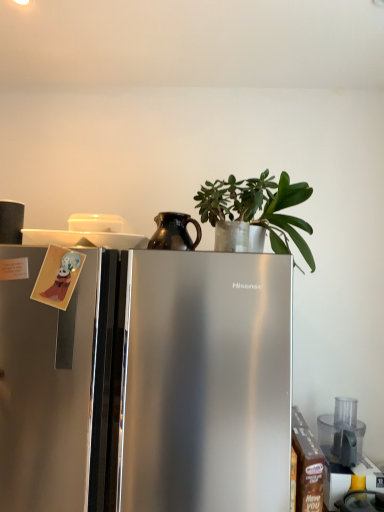
Question: From the image's perspective, is matte black coffee cup at upper left, which appears as the third appliance when viewed from the right, above or below green matte plant at upper center?

Choices:
 (A) below
 (B) above

Answer: (A)

Question: In terms of height, does matte black coffee cup at upper left, the 3th appliance from the bottom, look taller or shorter compared to green matte plant at upper center?

Choices:
 (A) tall
 (B) short

Answer: (B)

Question: Which object is the farthest from the matte black coffee cup at upper left, which is the 2th appliance in back-to-front order?

Choices:
 (A) green matte plant at upper center
 (B) shiny brown pitcher at center, which ranks as the 2th appliance in left-to-right order
 (C) transparent plastic food processor at lower right, the third appliance when ordered from left to right
 (D) satin silver refrigerator at center

Answer: (C)

Question: Considering the real-world distances, which object is closest to the matte black coffee cup at upper left, the 1th appliance viewed from the top?

Choices:
 (A) shiny brown pitcher at center, acting as the 3th appliance starting from the back
 (B) transparent plastic food processor at lower right, marked as the 1th appliance in a bottom-to-top arrangement
 (C) green matte plant at upper center
 (D) satin silver refrigerator at center

Answer: (A)